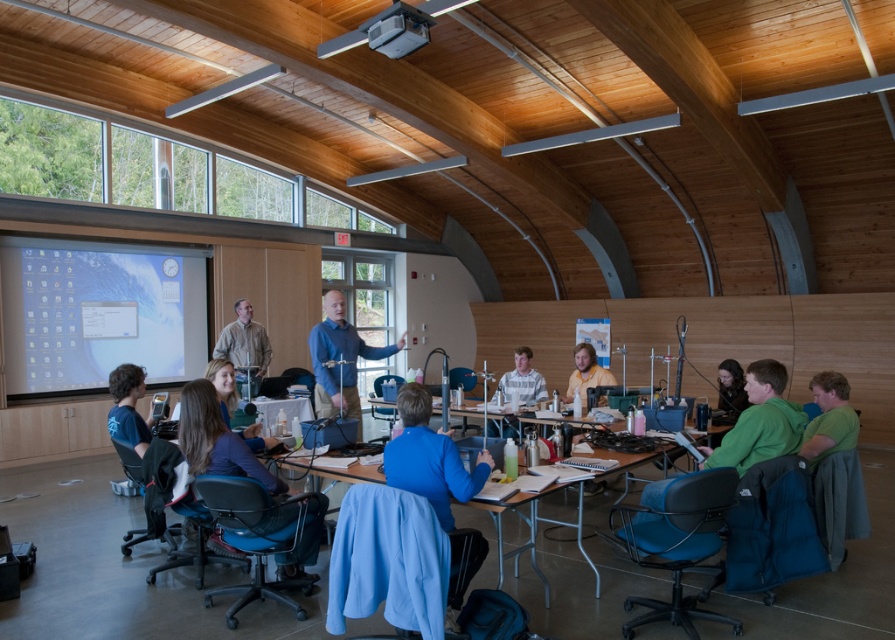
You are a teacher in the classroom and want to walk from the blue shirt at center to the yellow shirt at center. What is the minimum distance you need to cover?

The minimum distance you need to cover between the blue shirt at center and the yellow shirt at center is 1.80 meters.

You are a student in the classroom and want to see the experiment happening at the front. You notice a light brown leather jacket at center and a yellow shirt at center. Which object is blocking your view of the experiment?

The yellow shirt at center is behind the light brown leather jacket at center, so the light brown leather jacket at center is blocking your view of the experiment.